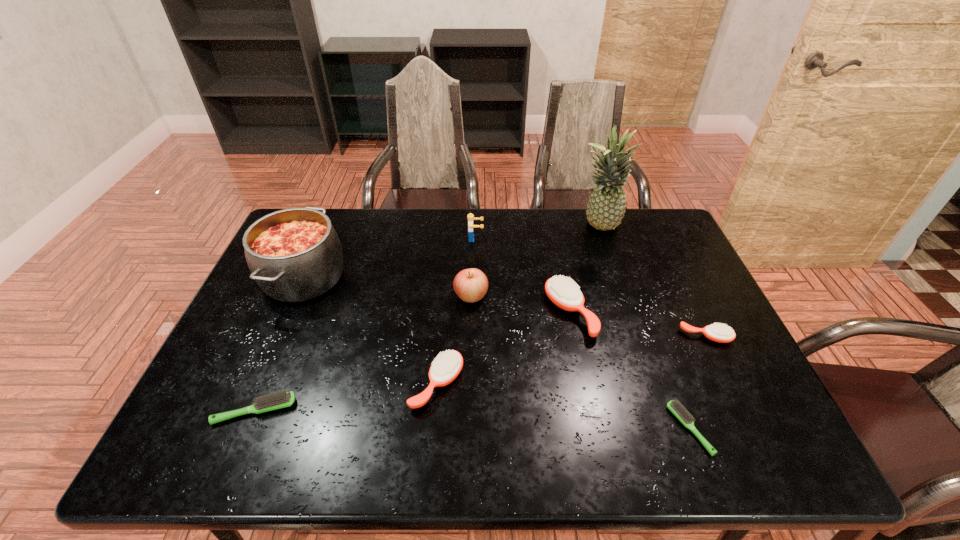
Identify the location of green pineapple. (606, 207).

This screenshot has width=960, height=540. I want to click on pineapple, so click(x=606, y=207).

At what (x,y) coordinates should I click in order to perform the action: click on the eighth shortest object. Please return your answer as a coordinate pair (x, y). Image resolution: width=960 pixels, height=540 pixels. Looking at the image, I should click on (294, 254).

Where is `gray casserole`? gray casserole is located at coordinates (294, 254).

Locate an element on the screen. Image resolution: width=960 pixels, height=540 pixels. blue Lego is located at coordinates (470, 216).

Identify the location of apple. The width and height of the screenshot is (960, 540). (470, 285).

Image resolution: width=960 pixels, height=540 pixels. In order to click on the sixth object from left to right in this screenshot , I will do `click(565, 294)`.

You are a GUI agent. You are given a task and a screenshot of the screen. Output one action in this format:
    pyautogui.click(x=<x>, y=<y>)
    Task: Click on the biggest orange hairbrush
    
    Given the screenshot: What is the action you would take?
    pyautogui.click(x=565, y=294)

Where is `the nearest orange hairbrush`? The height and width of the screenshot is (540, 960). the nearest orange hairbrush is located at coordinates (446, 367).

Find the location of a particular element. This screenshot has height=540, width=960. the leftmost orange hairbrush is located at coordinates (446, 367).